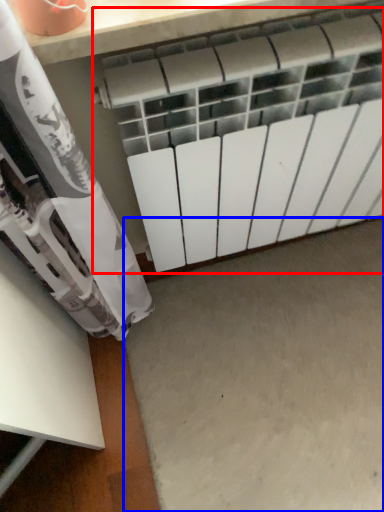
Question: Which object is closer to the camera taking this photo, radiator (highlighted by a red box) or concrete (highlighted by a blue box)?

Choices:
 (A) radiator
 (B) concrete

Answer: (A)